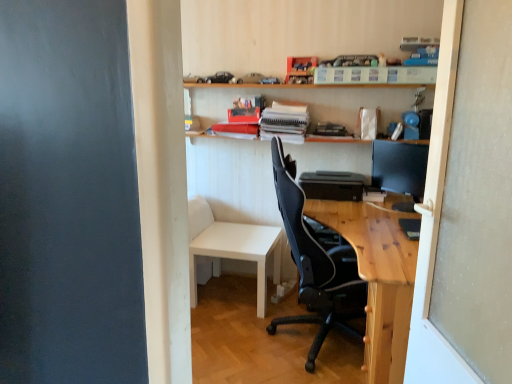
Question: From the image's perspective, is black plastic printer at center positioned above or below black glossy monitor at upper right?

Choices:
 (A) above
 (B) below

Answer: (B)

Question: Based on their positions, is black plastic printer at center located to the left or right of black glossy monitor at upper right?

Choices:
 (A) left
 (B) right

Answer: (A)

Question: Which is nearer to the black plastic printer at center?

Choices:
 (A) white paper stack at center
 (B) white matte table at lower center
 (C) black glossy monitor at upper right
 (D) wooden shelf at upper center
 (E) natural wood desk at center

Answer: (C)

Question: Estimate the real-world distances between objects in this image. Which object is farther from the transparent glass screen door at right?

Choices:
 (A) black mesh chair at center
 (B) black glossy monitor at upper right
 (C) wooden shelf at upper center
 (D) white paper stack at center
 (E) white matte table at lower center

Answer: (D)